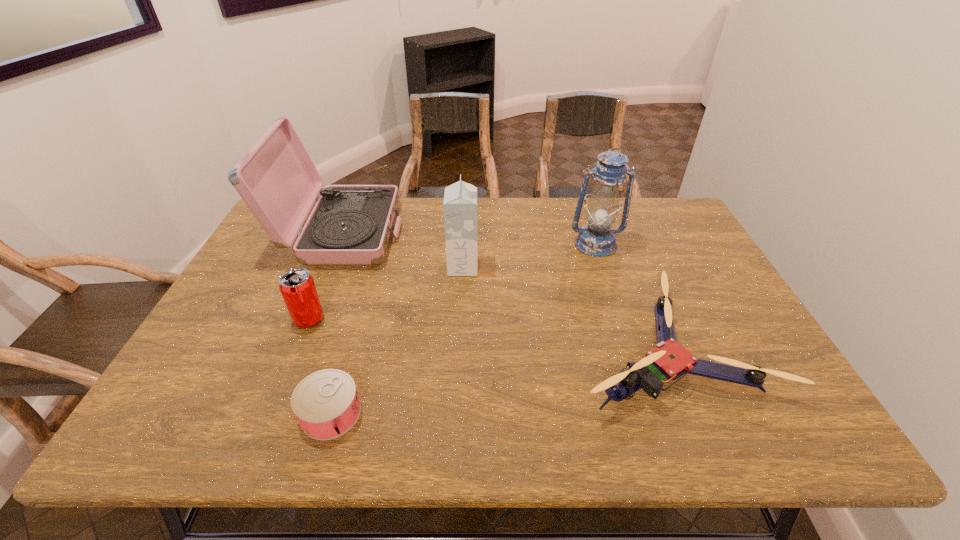
Image resolution: width=960 pixels, height=540 pixels. Identify the location of vacant space located on the back of the drone. (615, 222).

Where is `vacant area situated 0.310m on the right of the shortest object`? The width and height of the screenshot is (960, 540). vacant area situated 0.310m on the right of the shortest object is located at coordinates (509, 413).

In order to click on lantern that is at the far edge in this screenshot , I will do `click(597, 239)`.

At what (x,y) coordinates should I click in order to perform the action: click on record player situated at the far edge. Please return your answer as a coordinate pair (x, y). Looking at the image, I should click on (350, 224).

Image resolution: width=960 pixels, height=540 pixels. What are the coordinates of `drone that is at the near edge` in the screenshot? It's located at (669, 360).

At what (x,y) coordinates should I click in order to perform the action: click on can present at the near edge. Please return your answer as a coordinate pair (x, y). The image size is (960, 540). Looking at the image, I should click on (326, 404).

Image resolution: width=960 pixels, height=540 pixels. What are the coordinates of `object that is at the left edge` in the screenshot? It's located at (350, 224).

Image resolution: width=960 pixels, height=540 pixels. I want to click on object that is at the right edge, so click(x=669, y=360).

I want to click on object present at the far left corner, so click(350, 224).

Identify the location of object present at the near right corner. The width and height of the screenshot is (960, 540). (669, 360).